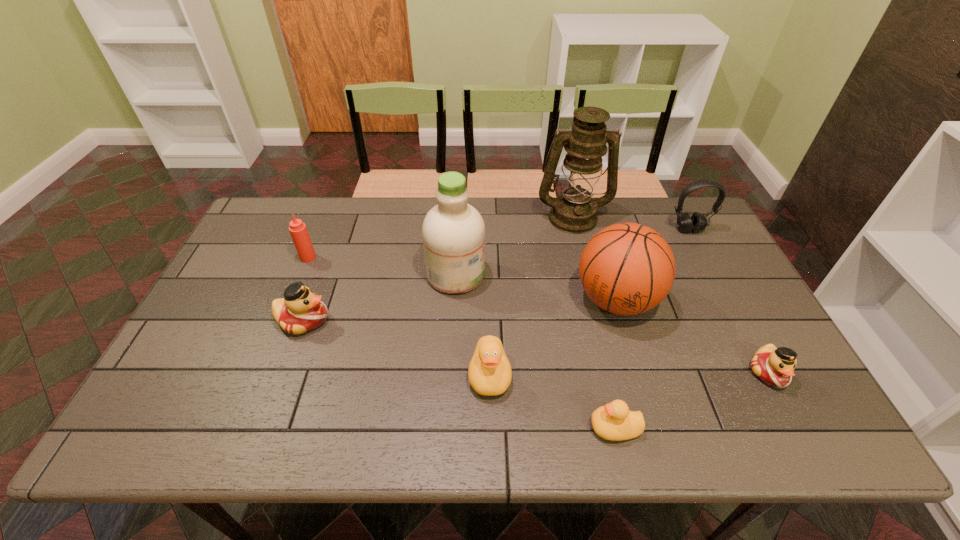
Find the location of `object present at the far right corner`. object present at the far right corner is located at coordinates (697, 222).

You are a GUI agent. You are given a task and a screenshot of the screen. Output one action in this format:
    pyautogui.click(x=<x>, y=<y>)
    Task: Click on the blank space at the far edge of the desktop
    Image resolution: width=960 pixels, height=540 pixels.
    Given the screenshot: What is the action you would take?
    pyautogui.click(x=356, y=201)

This screenshot has width=960, height=540. I want to click on blank space at the near edge of the desktop, so click(408, 410).

Locate an element on the screen. The width and height of the screenshot is (960, 540). free point at the left edge is located at coordinates (252, 331).

This screenshot has width=960, height=540. In the image, there is a desktop. What are the coordinates of `vacant area at the right edge` in the screenshot? It's located at (735, 297).

In the image, there is a desktop. In order to click on vacant space at the far left corner in this screenshot , I will do `click(288, 239)`.

Locate an element on the screen. The width and height of the screenshot is (960, 540). free space between the basketball and the left yellow duck is located at coordinates (553, 338).

At what (x,y) coordinates should I click in order to perform the action: click on free space between the seventh shortest object and the farther red duck. Please return your answer as a coordinate pair (x, y). Looking at the image, I should click on point(460,310).

This screenshot has height=540, width=960. What are the coordinates of `free spot between the nearer red duck and the headset` in the screenshot? It's located at (729, 301).

Where is `vacant region between the second tallest object and the basketball`? Image resolution: width=960 pixels, height=540 pixels. vacant region between the second tallest object and the basketball is located at coordinates coord(536,287).